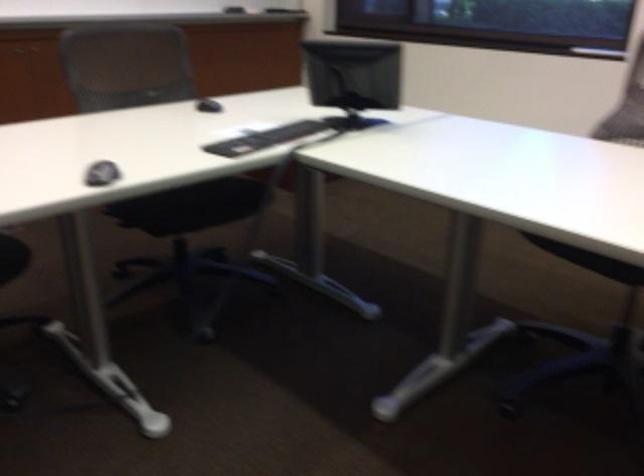
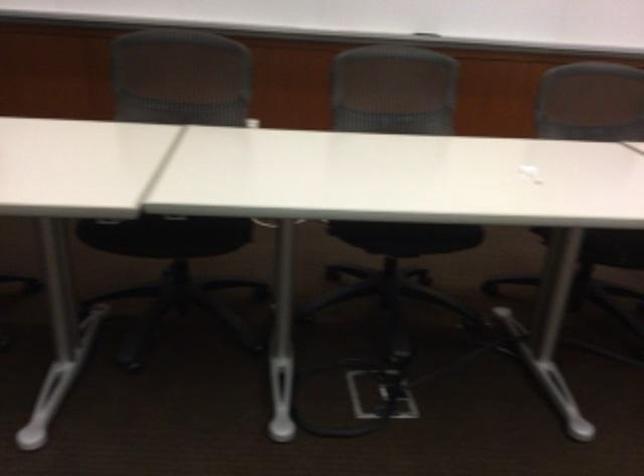
Question: The camera is either moving clockwise (left) or counter-clockwise (right) around the object. The first image is from the beginning of the video and the second image is from the end. Is the camera moving left or right when shooting the video?

Choices:
 (A) Left
 (B) Right

Answer: (B)